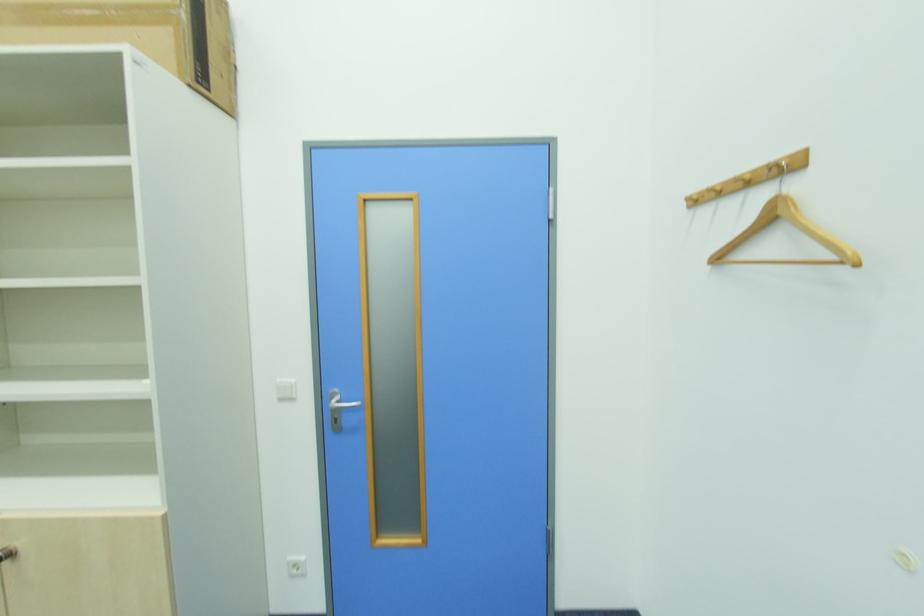
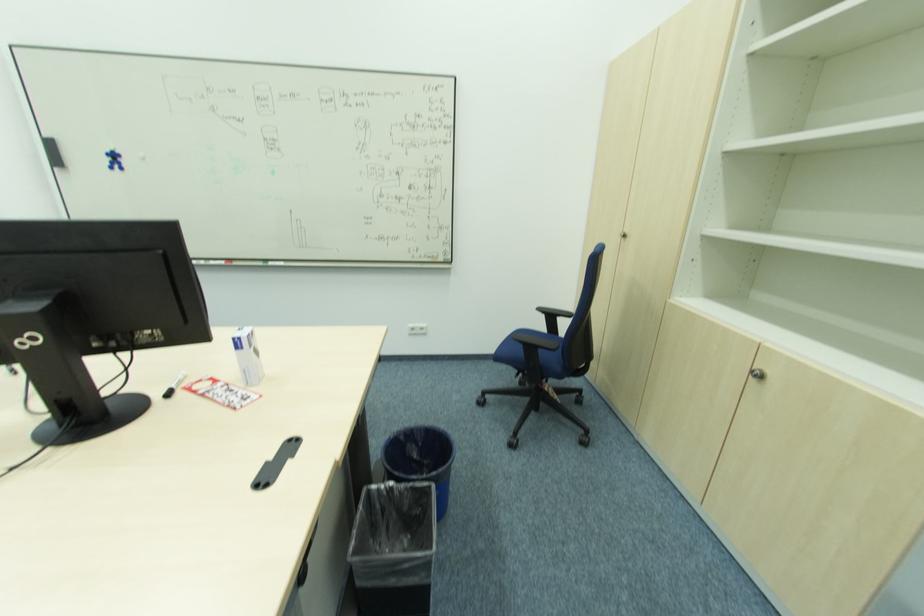
In the scene shown: Based on the continuous images, in which direction is the camera rotating?

The camera rotated toward left-down.